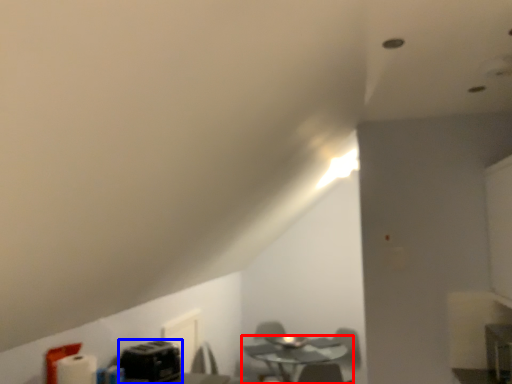
Question: Among these objects, which one is nearest to the camera, table (highlighted by a red box) or appliance (highlighted by a blue box)?

Choices:
 (A) table
 (B) appliance

Answer: (B)